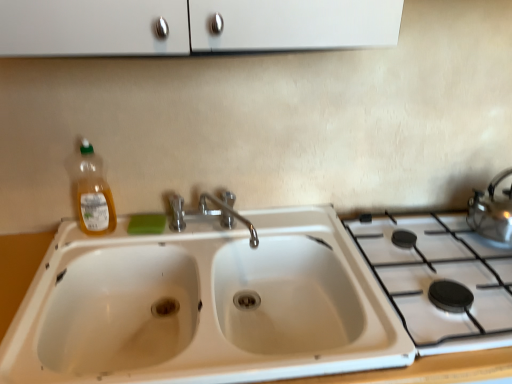
Question: From the image's perspective, is satin silver kettle at right located above chrome metallic faucet at center?

Choices:
 (A) yes
 (B) no

Answer: (A)

Question: From a real-world perspective, is satin silver kettle at right on chrome metallic faucet at center?

Choices:
 (A) no
 (B) yes

Answer: (B)

Question: Considering the relative sizes of satin silver kettle at right and chrome metallic faucet at center in the image provided, is satin silver kettle at right wider than chrome metallic faucet at center?

Choices:
 (A) no
 (B) yes

Answer: (A)

Question: Does satin silver kettle at right have a greater height compared to chrome metallic faucet at center?

Choices:
 (A) yes
 (B) no

Answer: (A)

Question: Is satin silver kettle at right facing towards chrome metallic faucet at center?

Choices:
 (A) no
 (B) yes

Answer: (A)

Question: Is satin silver kettle at right to the left or to the right of chrome metallic faucet at center in the image?

Choices:
 (A) left
 (B) right

Answer: (B)

Question: Considering the positions of satin silver kettle at right and chrome metallic faucet at center in the image, is satin silver kettle at right wider or thinner than chrome metallic faucet at center?

Choices:
 (A) thin
 (B) wide

Answer: (A)

Question: Looking at the image, does satin silver kettle at right seem bigger or smaller compared to chrome metallic faucet at center?

Choices:
 (A) big
 (B) small

Answer: (B)

Question: From a real-world perspective, relative to chrome metallic faucet at center, is satin silver kettle at right vertically above or below?

Choices:
 (A) below
 (B) above

Answer: (B)

Question: Is satin silver kettle at right taller or shorter than white ceramic sink at center?

Choices:
 (A) short
 (B) tall

Answer: (A)

Question: From the image's perspective, is satin silver kettle at right positioned above or below white ceramic sink at center?

Choices:
 (A) below
 (B) above

Answer: (B)

Question: Based on their positions, is satin silver kettle at right located to the left or right of white ceramic sink at center?

Choices:
 (A) right
 (B) left

Answer: (A)

Question: Relative to white ceramic sink at center, is satin silver kettle at right in front or behind?

Choices:
 (A) behind
 (B) front

Answer: (A)

Question: Does point (223, 206) appear closer or farther from the camera than point (157, 231)?

Choices:
 (A) closer
 (B) farther

Answer: (B)

Question: Considering the relative positions of chrome metallic faucet at center and green matte soap at center in the image provided, is chrome metallic faucet at center to the left or to the right of green matte soap at center?

Choices:
 (A) left
 (B) right

Answer: (B)